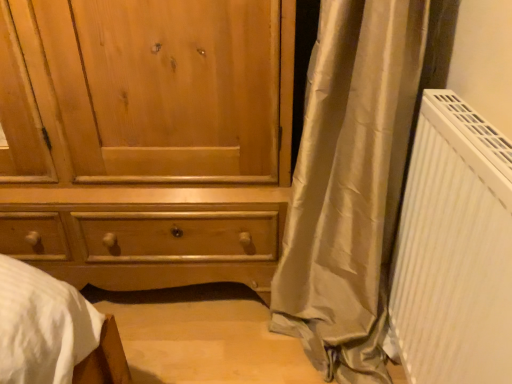
This screenshot has width=512, height=384. Describe the element at coordinates (454, 249) in the screenshot. I see `white ribbed radiator at right` at that location.

This screenshot has width=512, height=384. What are the coordinates of `white ribbed radiator at right` in the screenshot? It's located at (454, 249).

Where is `white ribbed radiator at right`? white ribbed radiator at right is located at coordinates (454, 249).